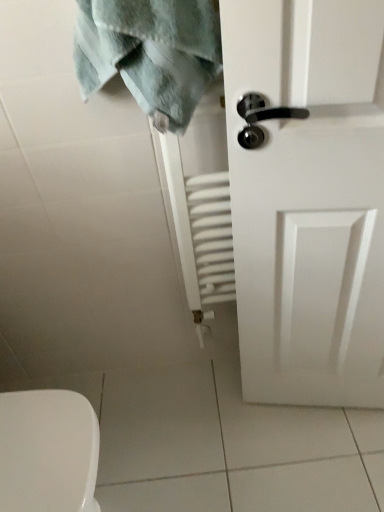
The image size is (384, 512). What do you see at coordinates (309, 200) in the screenshot?
I see `white matte door at right` at bounding box center [309, 200].

Locate an element on the screen. Image resolution: width=384 pixels, height=512 pixels. white matte door at right is located at coordinates (309, 200).

At what (x,y) coordinates should I click in order to perform the action: click on green textured towel at upper left. Please return your answer as a coordinate pair (x, y). Looking at the image, I should click on (150, 53).

This screenshot has width=384, height=512. What do you see at coordinates (150, 53) in the screenshot?
I see `green textured towel at upper left` at bounding box center [150, 53].

You are a GUI agent. You are given a task and a screenshot of the screen. Output one action in this format:
    pyautogui.click(x=<x>, y=<y>)
    Task: Click on the white matte door at right
    The height and width of the screenshot is (512, 384).
    Given the screenshot: What is the action you would take?
    pyautogui.click(x=309, y=200)

Which object is positioned more to the left, white matte door at right or green textured towel at upper left?

green textured towel at upper left.

Between white matte door at right and green textured towel at upper left, which one is positioned in front?

white matte door at right is in front.

Is point (262, 202) closer to viewer compared to point (117, 35)?

No, (262, 202) is behind (117, 35).

From the image's perspective, is white matte door at right on green textured towel at upper left?

No.

From a real-world perspective, is white matte door at right above or below green textured towel at upper left?

Clearly, from a real-world perspective, white matte door at right is below green textured towel at upper left.

Between white matte door at right and green textured towel at upper left, which one has smaller width?

With smaller width is white matte door at right.

Considering the sizes of white matte door at right and green textured towel at upper left in the image, is white matte door at right taller or shorter than green textured towel at upper left?

Clearly, white matte door at right is taller compared to green textured towel at upper left.

From the picture: Considering the sizes of objects white matte door at right and green textured towel at upper left in the image provided, who is smaller, white matte door at right or green textured towel at upper left?

green textured towel at upper left.

Which is correct: white matte door at right is inside green textured towel at upper left, or outside of it?

white matte door at right lies outside green textured towel at upper left.

In the scene shown: Are white matte door at right and green textured towel at upper left far apart?

No, white matte door at right is in close proximity to green textured towel at upper left.

Could you tell me if white matte door at right is turned towards green textured towel at upper left?

No, white matte door at right is not facing towards green textured towel at upper left.

What's the angular difference between white matte door at right and green textured towel at upper left's facing directions?

They differ by 10 degrees in their facing directions.

Locate an element on the screen. bath towel on the left side of white matte door at right is located at coordinates (150, 53).

Is green textured towel at upper left at the right side of white matte door at right?

No.

Is green textured towel at upper left in front of or behind white matte door at right in the image?

Clearly, green textured towel at upper left is behind white matte door at right.

Is point (170, 26) closer to camera compared to point (337, 51)?

No.

From the image's perspective, is green textured towel at upper left under white matte door at right?

Incorrect, from the image's perspective, green textured towel at upper left is higher than white matte door at right.

From a real-world perspective, is green textured towel at upper left positioned above or below white matte door at right?

From a real-world perspective, green textured towel at upper left is physically above white matte door at right.

Considering the sizes of objects green textured towel at upper left and white matte door at right in the image provided, who is wider, green textured towel at upper left or white matte door at right?

green textured towel at upper left is wider.

Does green textured towel at upper left have a greater height compared to white matte door at right?

In fact, green textured towel at upper left may be shorter than white matte door at right.

Does green textured towel at upper left have a smaller size compared to white matte door at right?

Correct, green textured towel at upper left occupies less space than white matte door at right.

Is white matte door at right surrounded by green textured towel at upper left?

No.

Are green textured towel at upper left and white matte door at right making contact?

They are not placed beside each other.

Could you tell me if green textured towel at upper left is turned towards white matte door at right?

No, green textured towel at upper left is not oriented towards white matte door at right.

How different are the orientations of green textured towel at upper left and white matte door at right in degrees?

There is a 10-degree angle between the facing directions of green textured towel at upper left and white matte door at right.

This screenshot has height=512, width=384. In order to click on bath towel above the white matte door at right (from the image's perspective) in this screenshot , I will do `click(150, 53)`.

At what (x,y) coordinates should I click in order to perform the action: click on bath towel that is on the left side of white matte door at right. Please return your answer as a coordinate pair (x, y). Looking at the image, I should click on (150, 53).

Image resolution: width=384 pixels, height=512 pixels. I want to click on bath towel behind the white matte door at right, so click(150, 53).